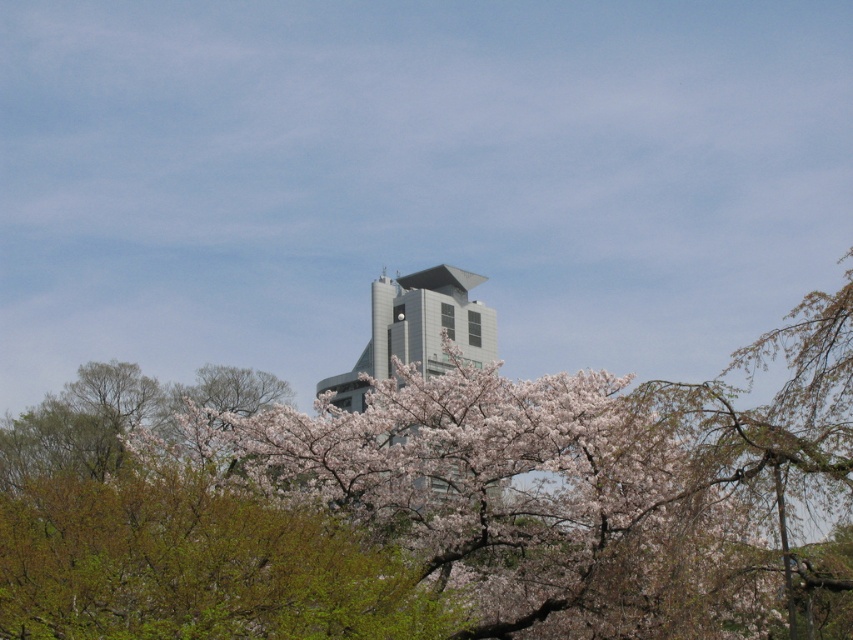
Question: Which of the following is the farthest from the observer?

Choices:
 (A) (733, 520)
 (B) (437, 320)

Answer: (B)

Question: Does pink blossoms at center have a larger size compared to gray metallic building at center?

Choices:
 (A) yes
 (B) no

Answer: (B)

Question: Does pink blossoms at center have a larger size compared to gray metallic building at center?

Choices:
 (A) yes
 (B) no

Answer: (B)

Question: Observing the image, what is the correct spatial positioning of pink blossoms at center in reference to gray metallic building at center?

Choices:
 (A) below
 (B) above

Answer: (A)

Question: Which point is farther to the camera?

Choices:
 (A) pink blossoms at center
 (B) gray metallic building at center

Answer: (B)

Question: Which object is closer to the camera taking this photo?

Choices:
 (A) pink blossoms at center
 (B) gray metallic building at center

Answer: (A)